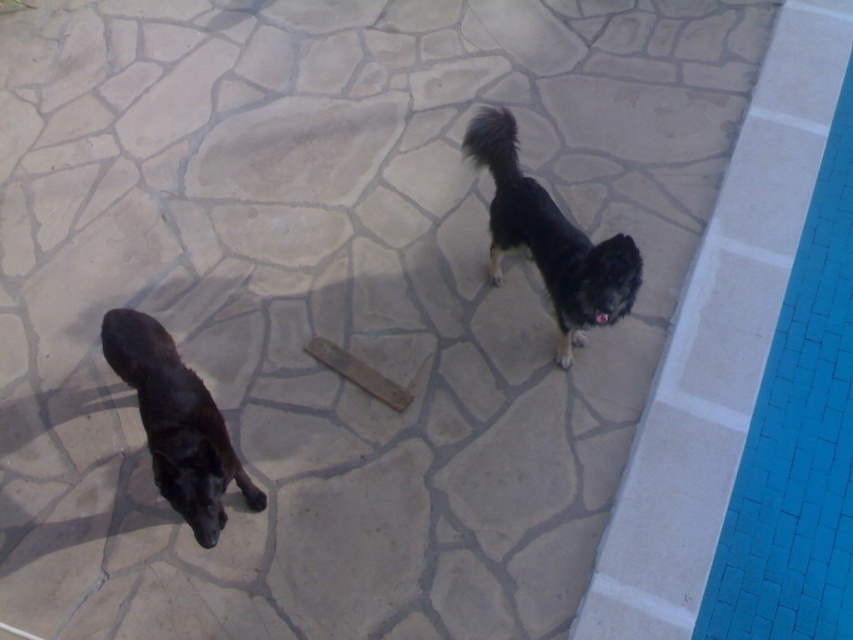
Is black fur dog at upper right positioned before wooden plank at center?

Yes, black fur dog at upper right is closer to the viewer.

Does black fur dog at upper right have a larger size compared to wooden plank at center?

Correct, black fur dog at upper right is larger in size than wooden plank at center.

Is point (560, 364) closer to viewer compared to point (347, 352)?

Yes, it is in front of point (347, 352).

The height and width of the screenshot is (640, 853). Find the location of `black fur dog at upper right`. black fur dog at upper right is located at coordinates (550, 237).

Consider the image. Does blue tile swimming pool at right appear over wooden plank at center?

Yes.

Measure the distance between blue tile swimming pool at right and camera.

They are 2.24 meters apart.

Which is behind, point (764, 512) or point (345, 376)?

The point (345, 376) is behind.

This screenshot has height=640, width=853. I want to click on blue tile swimming pool at right, so click(798, 440).

Describe the element at coordinates (550, 237) in the screenshot. I see `black fur dog at upper right` at that location.

Describe the element at coordinates (550, 237) in the screenshot. I see `black fur dog at upper right` at that location.

You are a GUI agent. You are given a task and a screenshot of the screen. Output one action in this format:
    pyautogui.click(x=<x>, y=<y>)
    Task: Click on the black fur dog at upper right
    
    Given the screenshot: What is the action you would take?
    pyautogui.click(x=550, y=237)